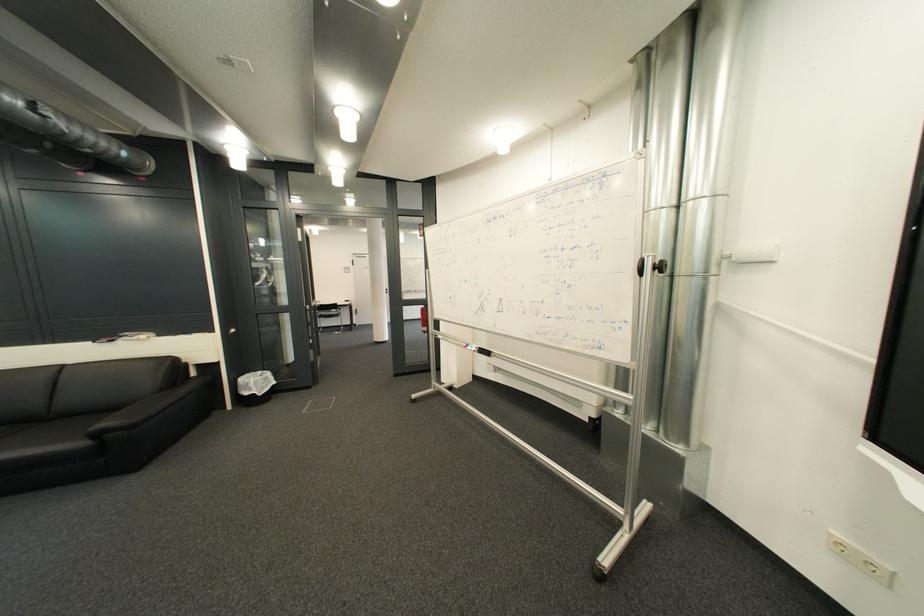
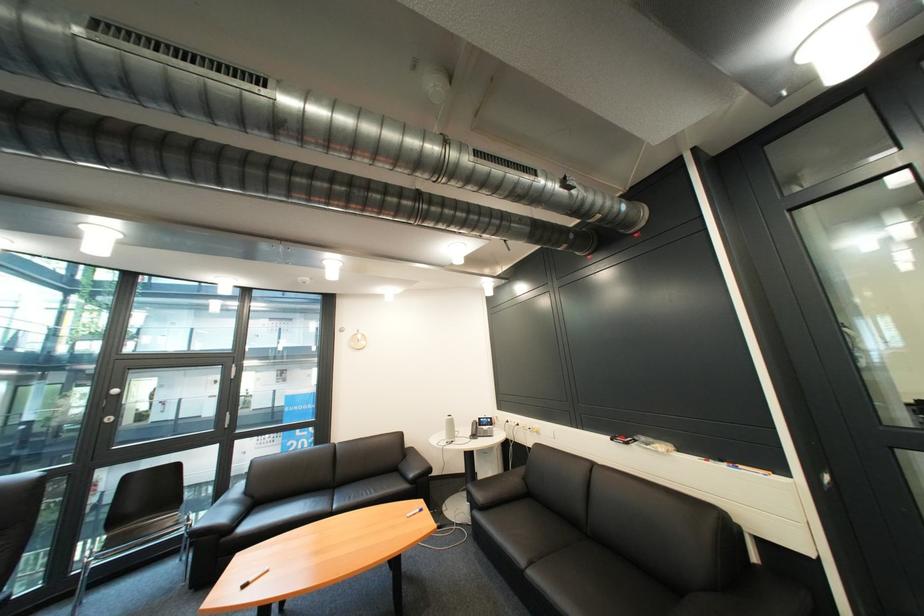
The point at (198, 338) is marked in the first image. Where is the corresponding point in the second image?

(736, 468)